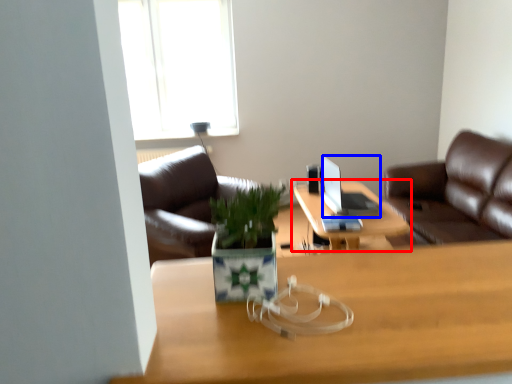
Question: Which object appears closest to the camera in this image, table (highlighted by a red box) or laptop (highlighted by a blue box)?

Choices:
 (A) table
 (B) laptop

Answer: (A)